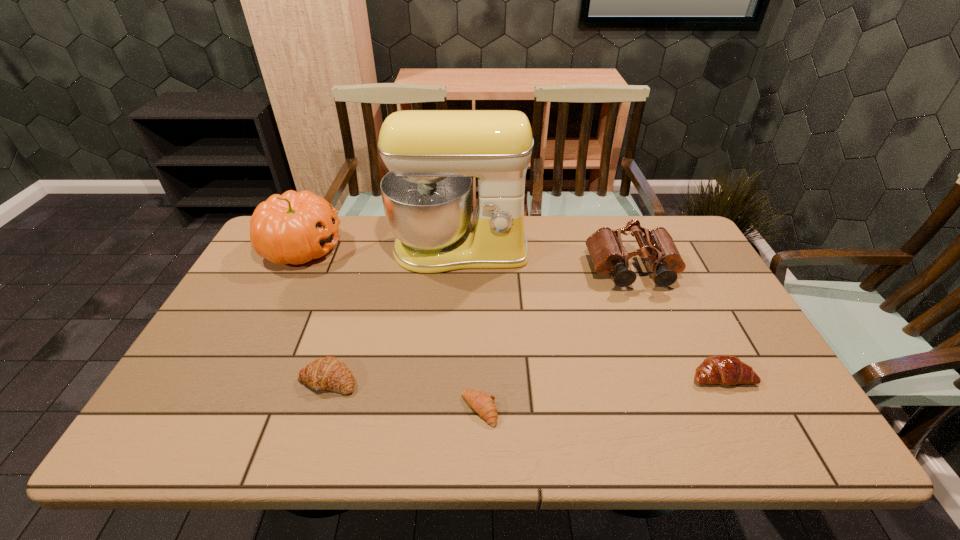
I want to click on crescent roll at the right edge, so click(x=720, y=369).

Identify the location of object that is at the far left corner. (293, 228).

This screenshot has height=540, width=960. Identify the location of object present at the far right corner. (608, 254).

Find the location of a particular element. The image size is (960, 540). vacant area at the far edge is located at coordinates (340, 231).

Locate an element on the screen. The width and height of the screenshot is (960, 540). free space at the near edge is located at coordinates (426, 435).

Locate an element on the screen. Image resolution: width=960 pixels, height=540 pixels. free region at the right edge is located at coordinates (742, 388).

Where is `free space at the near left corner of the desktop`? The height and width of the screenshot is (540, 960). free space at the near left corner of the desktop is located at coordinates (165, 423).

Find the location of a particular element. free point at the near right corner is located at coordinates (761, 446).

Locate an element on the screen. Image resolution: width=960 pixels, height=540 pixels. free point between the fifth shortest object and the rightmost crescent roll is located at coordinates (512, 312).

The width and height of the screenshot is (960, 540). What are the coordinates of `vacant space that's between the second tallest object and the shortest object` in the screenshot? It's located at (391, 329).